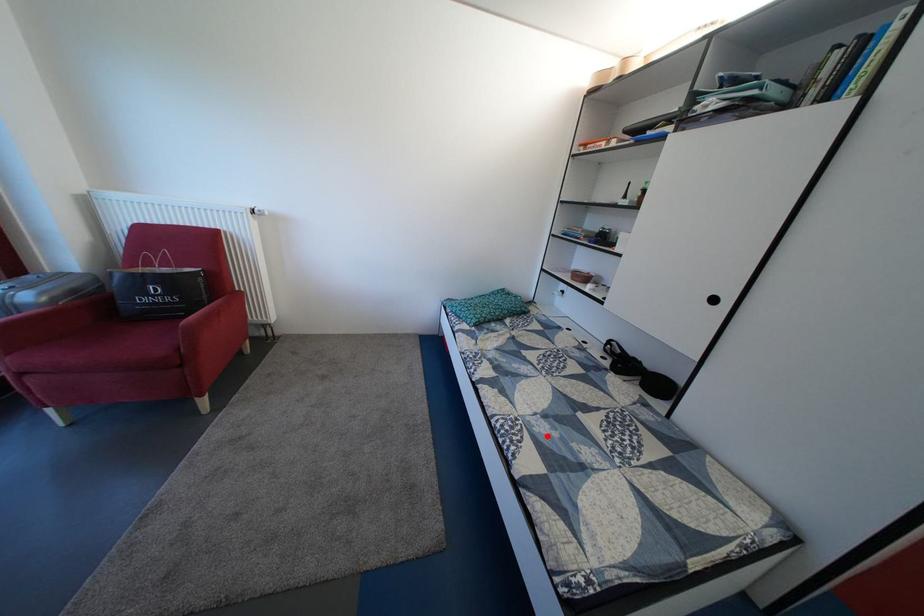
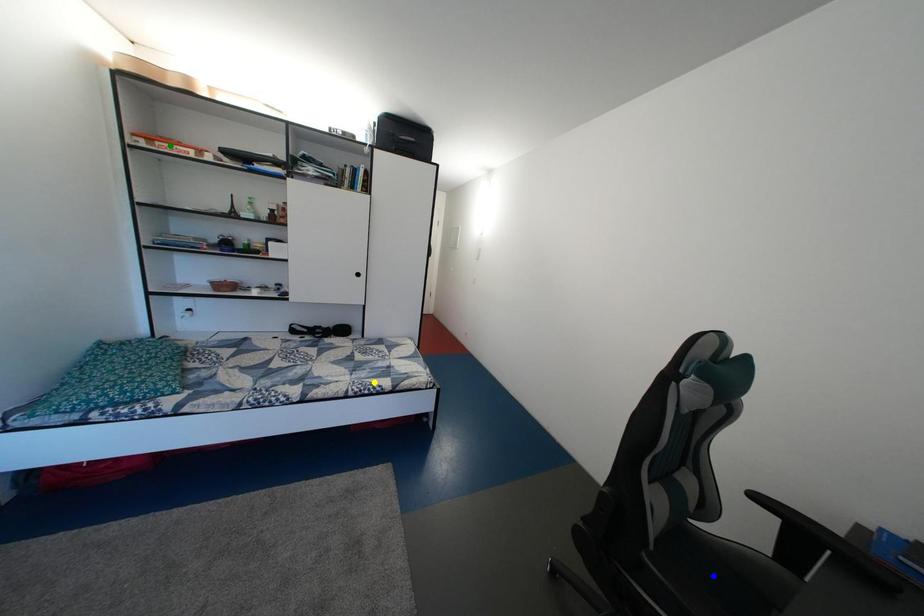
Question: I am providing you with two images of the same scene from different viewpoints. A red point is marked on the first image. You are given multiple points on the second image. Which spot in image 2 lines up with the point in image 1?

Choices:
 (A) yellow point
 (B) blue point
 (C) green point

Answer: (A)